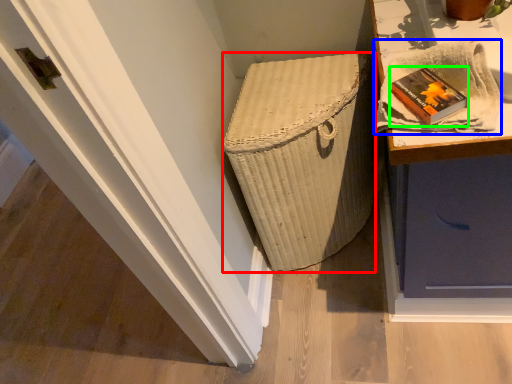
Question: Estimate the real-world distances between objects in this image. Which object is closer to basket container (highlighted by a red box), cloth (highlighted by a blue box) or book (highlighted by a green box)?

Choices:
 (A) cloth
 (B) book

Answer: (A)